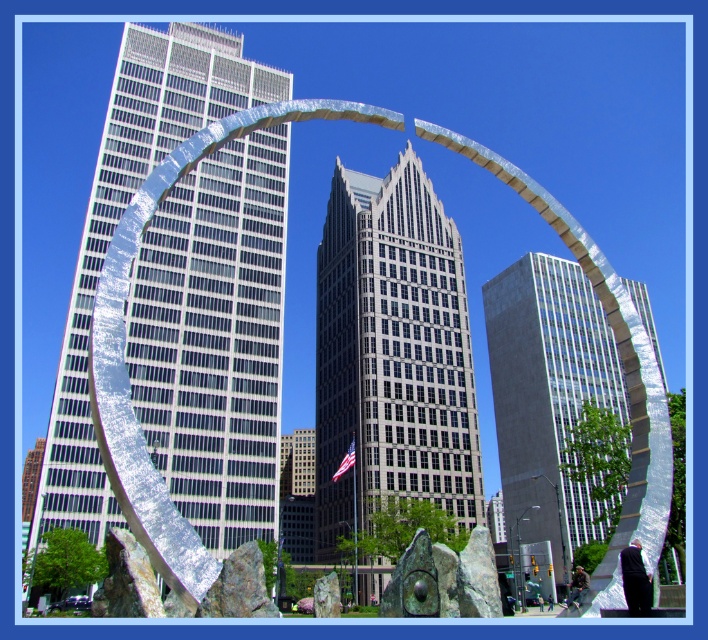
You are standing at the entrance of the urban scene and want to locate the shiny metallic arch at center. According to the coordinates provided, where would you find it in relation to the skyscrapers?

The shiny metallic arch at center is located at coordinates point (125, 337), which places it in the lower central area of the image, closer to the base of the tallest skyscraper in the center.

You are an architect planning to install a new light pole between the dark gray glass skyscraper at center and the gray concrete skyscraper at center. Which skyscraper should the light pole be closer to if you want it to cast a longer shadow during sunset?

The light pole should be closer to the gray concrete skyscraper at center because it is shorter than the dark gray glass skyscraper at center, so its shadow will be longer when the sun is low.

What object is located at the coordinates point (215, 339) in the image?

The point (215, 339) corresponds to the silver metallic sculpture at center.